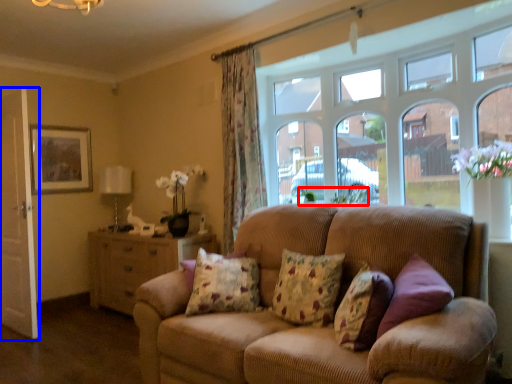
Question: Which object is further to the camera taking this photo, plant (highlighted by a red box) or screen door (highlighted by a blue box)?

Choices:
 (A) plant
 (B) screen door

Answer: (B)